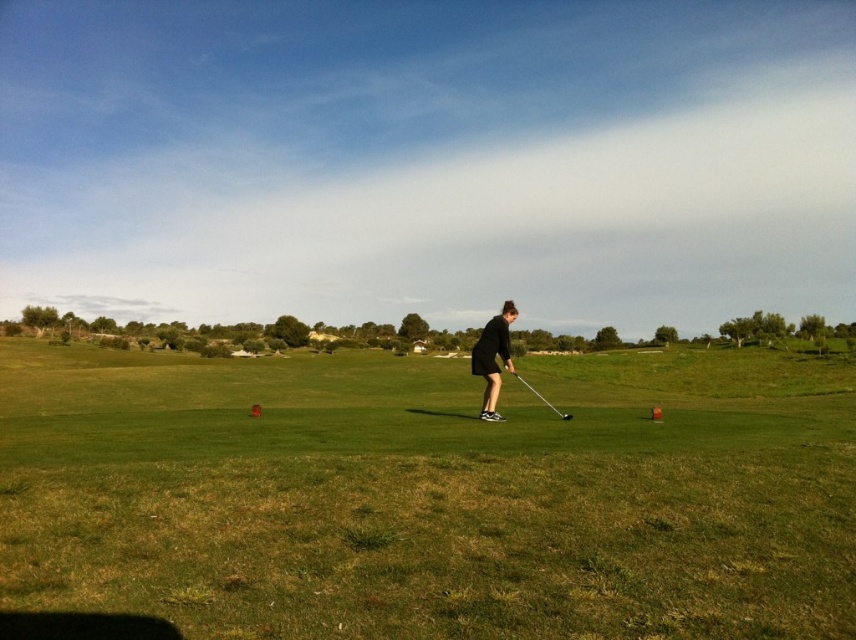
Between point (363, 621) and point (486, 323), which one is positioned behind?

The point (486, 323) is behind.

Can you confirm if green grass at center is taller than black matte golf club at center?

Yes.

Is point (369, 552) behind point (501, 419)?

No, it is in front of (501, 419).

The image size is (856, 640). I want to click on green grass at center, so click(x=429, y=497).

What do you see at coordinates (492, 358) in the screenshot? I see `black matte golf club at center` at bounding box center [492, 358].

Is black matte golf club at center below metallic silver golf club at center?

No.

Which is behind, point (508, 349) or point (535, 394)?

Positioned behind is point (535, 394).

Where is `black matte golf club at center`? black matte golf club at center is located at coordinates (492, 358).

Who is lower down, green grass at center or metallic silver golf club at center?

Positioned lower is green grass at center.

Is green grass at center bigger than metallic silver golf club at center?

Correct, green grass at center is larger in size than metallic silver golf club at center.

Locate an element on the screen. This screenshot has height=640, width=856. green grass at center is located at coordinates (429, 497).